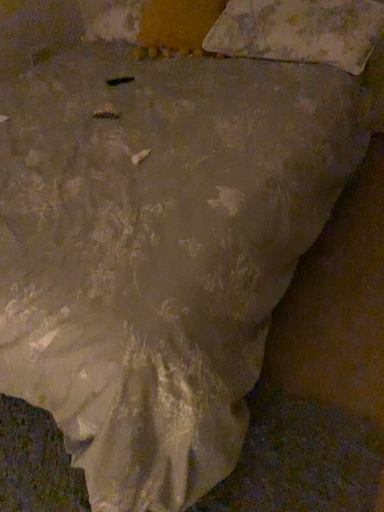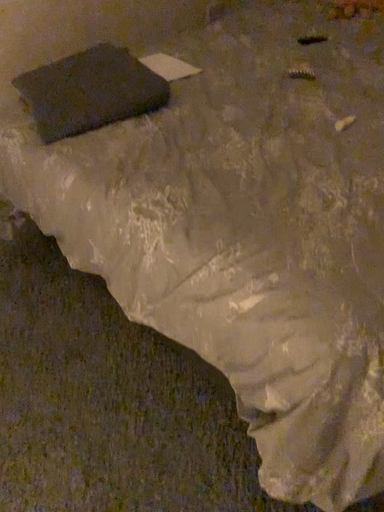
Question: How did the camera likely rotate when shooting the video?

Choices:
 (A) rotated left
 (B) rotated right

Answer: (A)